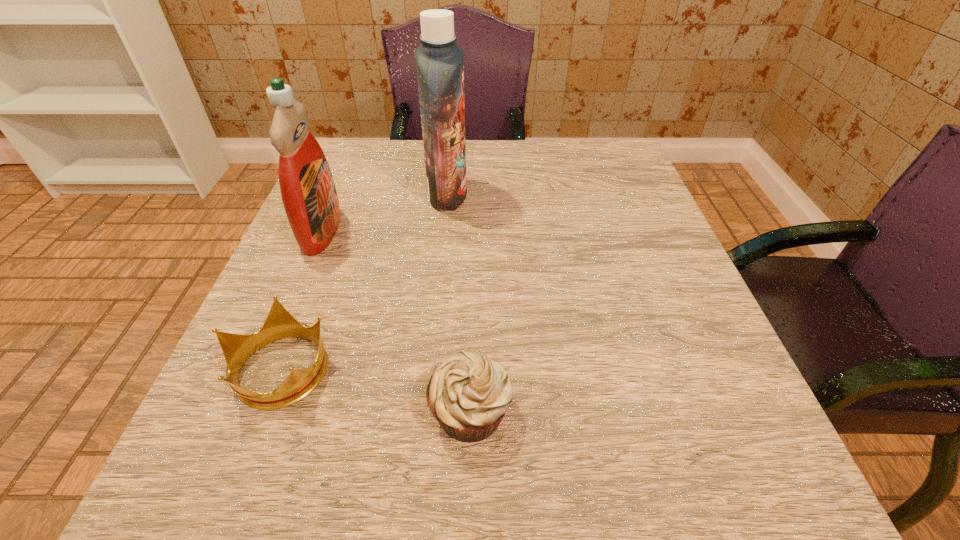
Where is `free space between the detergent and the muffin`? This screenshot has width=960, height=540. free space between the detergent and the muffin is located at coordinates (396, 321).

Identify the location of free space between the crown and the second tallest object. (301, 300).

I want to click on free spot between the tallest object and the detergent, so click(385, 213).

I want to click on empty location between the shampoo and the detergent, so click(x=385, y=213).

The image size is (960, 540). I want to click on vacant space in between the muffin and the crown, so click(375, 390).

I want to click on unoccupied area between the muffin and the third shortest object, so click(x=396, y=321).

Find the location of `vacant area that lies between the muffin and the second tallest object`. vacant area that lies between the muffin and the second tallest object is located at coordinates (396, 321).

Where is `unoccupied area between the detergent and the shampoo`? The width and height of the screenshot is (960, 540). unoccupied area between the detergent and the shampoo is located at coordinates (385, 213).

Identify which object is located as the third nearest to the tallest object. Please provide its 2D coordinates. Your answer should be formatted as a tuple, i.e. [(x, y)], where the tuple contains the x and y coordinates of a point satisfying the conditions above.

[(469, 394)]

Select which object is the closest to the third shortest object. Please provide its 2D coordinates. Your answer should be formatted as a tuple, i.e. [(x, y)], where the tuple contains the x and y coordinates of a point satisfying the conditions above.

[(439, 61)]